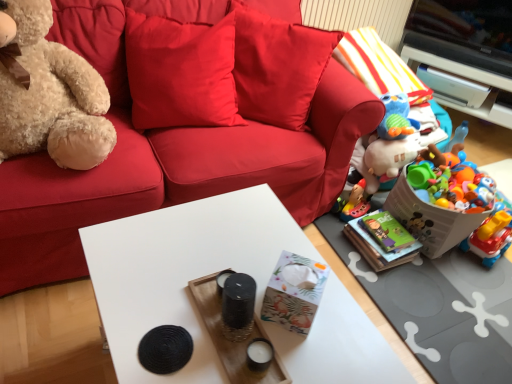
Where is `white glossy cabinet at upper right`? This screenshot has height=384, width=512. white glossy cabinet at upper right is located at coordinates (456, 68).

This screenshot has width=512, height=384. What are the coordinates of `velvet red couch at center` in the screenshot? It's located at (187, 134).

Measure the distance between velvet red couch at center and camera.

velvet red couch at center and camera are 4.12 feet apart.

The width and height of the screenshot is (512, 384). What do you see at coordinates (49, 93) in the screenshot? I see `fuzzy beige teddy bear at left` at bounding box center [49, 93].

The height and width of the screenshot is (384, 512). What do you see at coordinates (429, 219) in the screenshot?
I see `plastic toy basket at lower right, placed as the first box when sorted from right to left` at bounding box center [429, 219].

The width and height of the screenshot is (512, 384). Describe the element at coordinates (181, 72) in the screenshot. I see `satin red pillow at upper center` at that location.

Measure the distance between point (x=511, y=247) and camera.

Point (x=511, y=247) and camera are 5.98 feet apart from each other.

You are a GUI agent. You are given a task and a screenshot of the screen. Output one action in this format:
    pyautogui.click(x=<x>, y=<y>)
    Task: Click on the white glossy cabinet at upper right
    Image resolution: width=512 pixels, height=384 pixels.
    Given the screenshot: What is the action you would take?
    pyautogui.click(x=456, y=68)

From the image's perspective, which object appears higher, fuzzy beige teddy bear at left or satin red pillow at upper center?

satin red pillow at upper center is shown above in the image.

Is point (18, 20) in front of point (167, 84)?

Yes, it is in front of point (167, 84).

Who is shorter, fuzzy beige teddy bear at left or satin red pillow at upper center?

satin red pillow at upper center.

Looking at the image, does fuzzy beige teddy bear at left seem bigger or smaller compared to satin red pillow at upper center?

Considering their sizes, fuzzy beige teddy bear at left takes up more space than satin red pillow at upper center.

In the scene shown: What's the angular difference between white glossy cabinet at upper right and velvet red couch at center's facing directions?

white glossy cabinet at upper right and velvet red couch at center are facing 146 degrees away from each other.

Does point (498, 124) appear closer or farther from the camera than point (41, 165)?

Point (498, 124).

From the image's perspective, is white glossy cabinet at upper right beneath velvet red couch at center?

No.

Is white glossy cabinet at upper right completely or partially outside of velvet red couch at center?

white glossy cabinet at upper right is positioned outside velvet red couch at center.

Consider the image. Is black woven coaster at lower center, which is the 1th toy from front to back, oriented away from plastic toy basket at lower right, which appears as the second box when viewed from the front?

No, plastic toy basket at lower right, which appears as the second box when viewed from the front, is not at the back of black woven coaster at lower center, which is the 1th toy from front to back.

Which is more to the left, black woven coaster at lower center, which is the 1th toy from front to back, or plastic toy basket at lower right, the 2th box viewed from the left?

From the viewer's perspective, black woven coaster at lower center, which is the 1th toy from front to back, appears more on the left side.

Would you say plastic toy basket at lower right, which appears as the second box when viewed from the front, is part of black woven coaster at lower center, marked as the 1th toy in a left-to-right arrangement,'s contents?

Actually, plastic toy basket at lower right, which appears as the second box when viewed from the front, is outside black woven coaster at lower center, marked as the 1th toy in a left-to-right arrangement.

Consider the image. Considering the sizes of objects black woven coaster at lower center, marked as the 1th toy in a left-to-right arrangement, and plastic toy basket at lower right, which appears as the second box when viewed from the front, in the image provided, who is thinner, black woven coaster at lower center, marked as the 1th toy in a left-to-right arrangement, or plastic toy basket at lower right, which appears as the second box when viewed from the front,?

black woven coaster at lower center, marked as the 1th toy in a left-to-right arrangement.

Would you consider velvet red couch at center to be distant from fuzzy beige teddy bear at left?

No, velvet red couch at center is not far from fuzzy beige teddy bear at left.

Between velvet red couch at center and fuzzy beige teddy bear at left, which one appears on the right side from the viewer's perspective?

Positioned to the right is velvet red couch at center.

Is velvet red couch at center oriented towards fuzzy beige teddy bear at left?

No, velvet red couch at center is not aimed at fuzzy beige teddy bear at left.

Which object is closer to the camera taking this photo, velvet red couch at center or fuzzy beige teddy bear at left?

fuzzy beige teddy bear at left.

Between point (428, 53) and point (206, 47), which one is positioned behind?

Positioned behind is point (428, 53).

Can you confirm if white glossy cabinet at upper right is smaller than satin red pillow at upper center?

Correct, white glossy cabinet at upper right occupies less space than satin red pillow at upper center.

Is white glossy cabinet at upper right not inside satin red pillow at upper center?

Indeed, white glossy cabinet at upper right is completely outside satin red pillow at upper center.

Is white glossy cabinet at upper right far from satin red pillow at upper center?

Indeed, white glossy cabinet at upper right is not near satin red pillow at upper center.

Would you say fuzzy beige teddy bear at left is to the left or to the right of plastic colorful toys at right, the second toy positioned from the back, in the picture?

fuzzy beige teddy bear at left is to the left of plastic colorful toys at right, the second toy positioned from the back.

Is fuzzy beige teddy bear at left facing away from plastic colorful toys at right, the 2th toy when ordered from front to back?

No, plastic colorful toys at right, the 2th toy when ordered from front to back, is not at the back of fuzzy beige teddy bear at left.

How much distance is there between fuzzy beige teddy bear at left and plastic colorful toys at right, the 2th toy when ordered from right to left?

fuzzy beige teddy bear at left is 2.20 meters from plastic colorful toys at right, the 2th toy when ordered from right to left.

Between plastic toy basket at lower right, placed as the first box when sorted from right to left, and satin red pillow at upper center, which one has more height?

With more height is satin red pillow at upper center.

In terms of width, does plastic toy basket at lower right, placed as the first box when sorted from right to left, look wider or thinner when compared to satin red pillow at upper center?

Considering their sizes, plastic toy basket at lower right, placed as the first box when sorted from right to left, looks broader than satin red pillow at upper center.

Is plastic toy basket at lower right, which appears as the second box when viewed from the front, oriented away from satin red pillow at upper center?

plastic toy basket at lower right, which appears as the second box when viewed from the front, is not turned away from satin red pillow at upper center.

Is plastic toy basket at lower right, the 2th box viewed from the left, in front of satin red pillow at upper center?

No, plastic toy basket at lower right, the 2th box viewed from the left, is further to the viewer.

Find the location of a particular element. pillow above the fuzzy beige teddy bear at left (from the image's perspective) is located at coordinates [x=181, y=72].

Locate an element on the screen. The image size is (512, 384). studio couch above the white glossy cabinet at upper right (from a real-world perspective) is located at coordinates (187, 134).

Considering their positions, is white glossy cabinet at upper right positioned closer to fuzzy beige teddy bear at left than floral paper tissue box at center, acting as the 1th box starting from the left?

floral paper tissue box at center, acting as the 1th box starting from the left.

Considering their positions, is plastic toy car at lower right, the 1th toy in the right-to-left sequence, positioned further to white glossy cabinet at upper right than white matte table at center?

white matte table at center.

Looking at the image, which one is located further to white glossy cabinet at upper right, black woven coaster at lower center, which is the 1th toy from front to back, or satin red pillow at upper center?

black woven coaster at lower center, which is the 1th toy from front to back, is positioned further to the anchor white glossy cabinet at upper right.

Based on the photo, from the image, which object appears to be farther from black woven coaster at lower center, marked as the 1th toy in a left-to-right arrangement, plastic toy basket at lower right, which appears as the second box when viewed from the front, or velvet red couch at center?

plastic toy basket at lower right, which appears as the second box when viewed from the front.

Based on their spatial positions, is plastic colorful toys at right, the 2th toy when ordered from right to left, or white glossy cabinet at upper right closer to velvet red couch at center?

Among the two, white glossy cabinet at upper right is located nearer to velvet red couch at center.

Which object lies further to the anchor point velvet red couch at center, black woven coaster at lower center, the 3th toy when ordered from right to left, or plastic colorful toys at right, the 2th toy when ordered from front to back?

The object further to velvet red couch at center is plastic colorful toys at right, the 2th toy when ordered from front to back.

Estimate the real-world distances between objects in this image. Which object is closer to black woven coaster at lower center, which is the 1th toy from front to back, velvet red couch at center or floral paper tissue box at center, acting as the 1th box starting from the left?

Among the two, floral paper tissue box at center, acting as the 1th box starting from the left, is located nearer to black woven coaster at lower center, which is the 1th toy from front to back.

Based on their spatial positions, is black woven coaster at lower center, positioned as the 3th toy in back-to-front order, or plastic colorful toys at right, the second toy positioned from the back, closer to plastic toy basket at lower right, placed as the first box when sorted from back to front?

Based on the image, plastic colorful toys at right, the second toy positioned from the back, appears to be nearer to plastic toy basket at lower right, placed as the first box when sorted from back to front.

Identify the location of box between fuzzy beige teddy bear at left and plastic toy basket at lower right, the 2th box viewed from the left, from left to right. This screenshot has height=384, width=512. (294, 292).

Locate an element on the screen. pillow between velvet red couch at center and plastic toy basket at lower right, the 2th box viewed from the left, from left to right is located at coordinates (181, 72).

The image size is (512, 384). What are the coordinates of `box positioned between floral paper tissue box at center, acting as the 1th box starting from the left, and white glossy cabinet at upper right from near to far` in the screenshot? It's located at (429, 219).

Where is `studio couch between fuzzy beige teddy bear at left and plastic toy car at lower right, the 1th toy in the right-to-left sequence`? The width and height of the screenshot is (512, 384). studio couch between fuzzy beige teddy bear at left and plastic toy car at lower right, the 1th toy in the right-to-left sequence is located at coordinates coord(187,134).